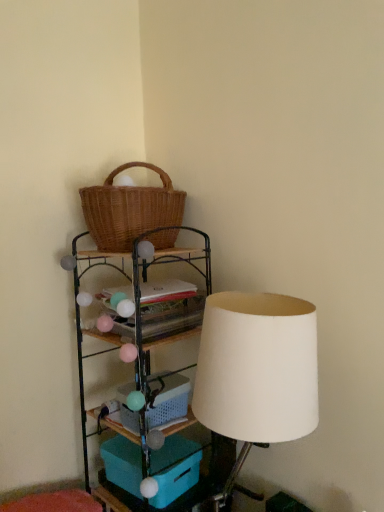
Question: Considering the relative sizes of woven wood shelf at upper left and teal plastic storage box at lower center in the image provided, is woven wood shelf at upper left wider than teal plastic storage box at lower center?

Choices:
 (A) yes
 (B) no

Answer: (A)

Question: Does woven wood shelf at upper left lie in front of teal plastic storage box at lower center?

Choices:
 (A) yes
 (B) no

Answer: (A)

Question: From a real-world perspective, is woven wood shelf at upper left over teal plastic storage box at lower center?

Choices:
 (A) no
 (B) yes

Answer: (B)

Question: Can you confirm if woven wood shelf at upper left is taller than teal plastic storage box at lower center?

Choices:
 (A) no
 (B) yes

Answer: (B)

Question: Is woven wood shelf at upper left facing towards teal plastic storage box at lower center?

Choices:
 (A) yes
 (B) no

Answer: (A)

Question: Would you say white matte lampshade at right is to the left or to the right of woven wood shelf at upper left in the picture?

Choices:
 (A) right
 (B) left

Answer: (A)

Question: Does point (316, 403) appear closer or farther from the camera than point (173, 506)?

Choices:
 (A) closer
 (B) farther

Answer: (A)

Question: Is white matte lampshade at right bigger or smaller than woven wood shelf at upper left?

Choices:
 (A) big
 (B) small

Answer: (B)

Question: In terms of height, does white matte lampshade at right look taller or shorter compared to woven wood shelf at upper left?

Choices:
 (A) tall
 (B) short

Answer: (B)

Question: Is woven brown picnic basket at upper left bigger or smaller than white matte lampshade at right?

Choices:
 (A) small
 (B) big

Answer: (A)

Question: Is woven brown picnic basket at upper left situated inside white matte lampshade at right or outside?

Choices:
 (A) inside
 (B) outside

Answer: (B)

Question: Considering the positions of woven brown picnic basket at upper left and white matte lampshade at right in the image, is woven brown picnic basket at upper left taller or shorter than white matte lampshade at right?

Choices:
 (A) tall
 (B) short

Answer: (B)

Question: Relative to white matte lampshade at right, is woven brown picnic basket at upper left in front or behind?

Choices:
 (A) front
 (B) behind

Answer: (B)

Question: Looking at their shapes, would you say plastic/mesh basket at lower center is wider or thinner than woven brown picnic basket at upper left?

Choices:
 (A) wide
 (B) thin

Answer: (B)

Question: Is point (168, 393) closer or farther from the camera than point (167, 223)?

Choices:
 (A) farther
 (B) closer

Answer: (A)